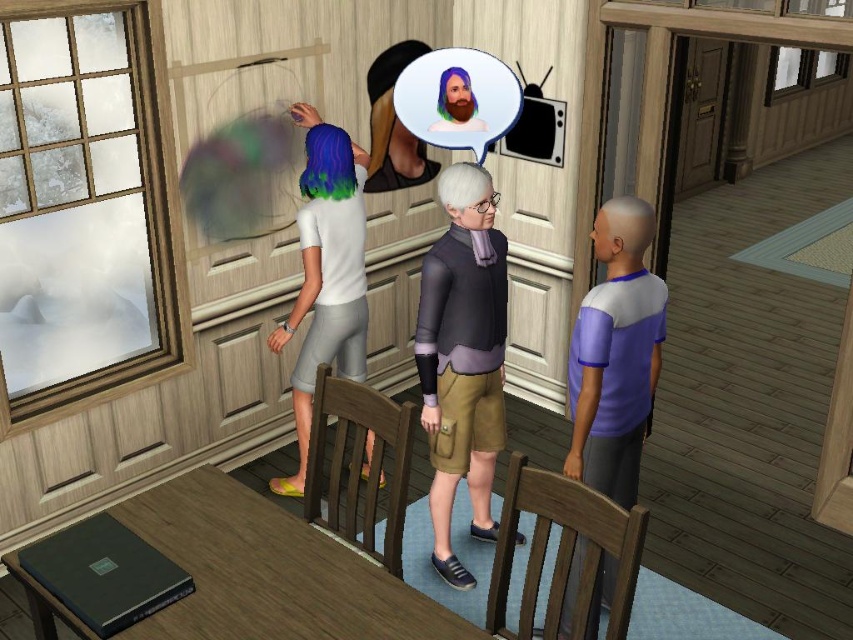
Consider the image. Is purple fabric shirt at right taller than white matte shirt at center?

No.

From the picture: Can you confirm if purple fabric shirt at right is smaller than white matte shirt at center?

Correct, purple fabric shirt at right occupies less space than white matte shirt at center.

Is point (612, 262) farther from viewer compared to point (334, 208)?

No, (612, 262) is closer to viewer.

Locate an element on the screen. purple fabric shirt at right is located at coordinates point(614,355).

Which is more to the left, dark gray sweater at center or bearded man at center?

From the viewer's perspective, bearded man at center appears more on the left side.

Is point (494, 296) positioned after point (480, 99)?

That is False.

Who is more forward, (453,428) or (502,112)?

Point (453,428) is more forward.

The height and width of the screenshot is (640, 853). Find the location of `dark gray sweater at center`. dark gray sweater at center is located at coordinates (462, 356).

Does point (590, 410) come closer to viewer compared to point (485, 124)?

That is True.

Which is more to the right, purple fabric shirt at right or bearded man at center?

From the viewer's perspective, purple fabric shirt at right appears more on the right side.

Identify the location of purple fabric shirt at right. The width and height of the screenshot is (853, 640). (614, 355).

The height and width of the screenshot is (640, 853). What are the coordinates of `purple fabric shirt at right` in the screenshot? It's located at (614, 355).